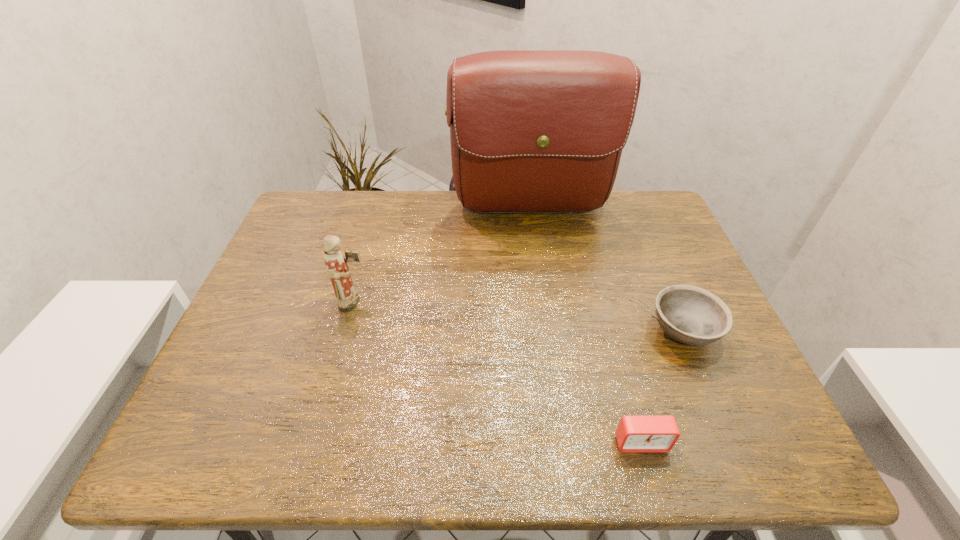
I want to click on the tallest object, so click(532, 131).

Locate an element on the screen. the farthest object is located at coordinates (532, 131).

Where is `figurine`? This screenshot has width=960, height=540. figurine is located at coordinates (336, 265).

Find the location of `the leftmost object`. the leftmost object is located at coordinates (336, 265).

You are a GUI agent. You are given a task and a screenshot of the screen. Output one action in this format:
    pyautogui.click(x=<x>, y=<y>)
    Task: Click on the bowl
    The width and height of the screenshot is (960, 540).
    Given the screenshot: What is the action you would take?
    pyautogui.click(x=691, y=315)

This screenshot has height=540, width=960. I want to click on alarm clock, so click(635, 434).

The image size is (960, 540). Identify the location of free spot located on the open flap of the farthest object. [548, 332].

At what (x,y) coordinates should I click in order to perform the action: click on vacant region located 0.170m on the front-facing side of the figurine. Please return your answer as a coordinate pair (x, y). This screenshot has height=540, width=960. Looking at the image, I should click on (436, 303).

The image size is (960, 540). What are the coordinates of `free point located 0.210m on the front of the bowl` in the screenshot? It's located at (733, 454).

This screenshot has width=960, height=540. What are the coordinates of `object that is at the far edge` in the screenshot? It's located at (532, 131).